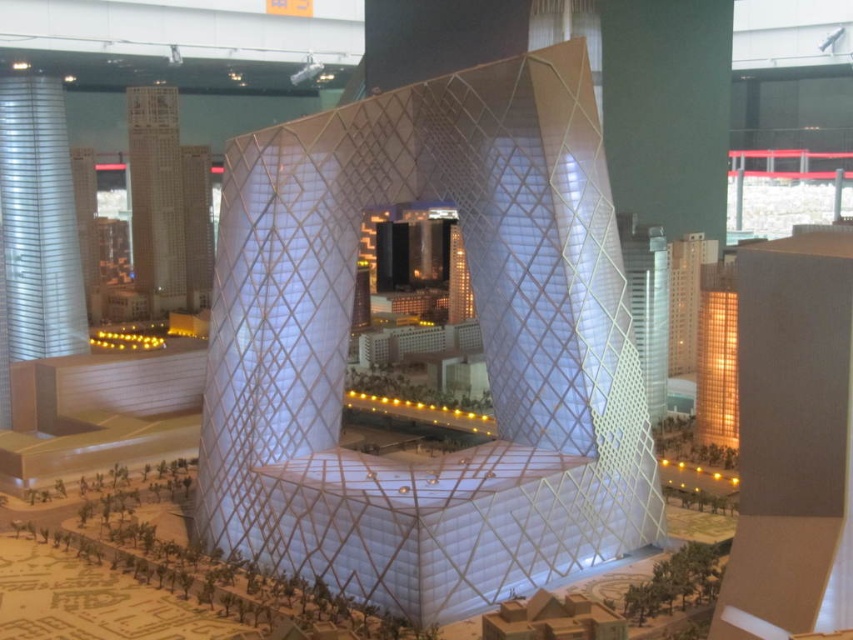
You are an urban planner reviewing the architectural model. You need to determine which of the two structures, the white textured building at upper left or the white mesh tower at right, requires more space for construction. Based on the model, which one would you choose?

The white textured building at upper left has a larger size compared to the white mesh tower at right, so it requires more space for construction.